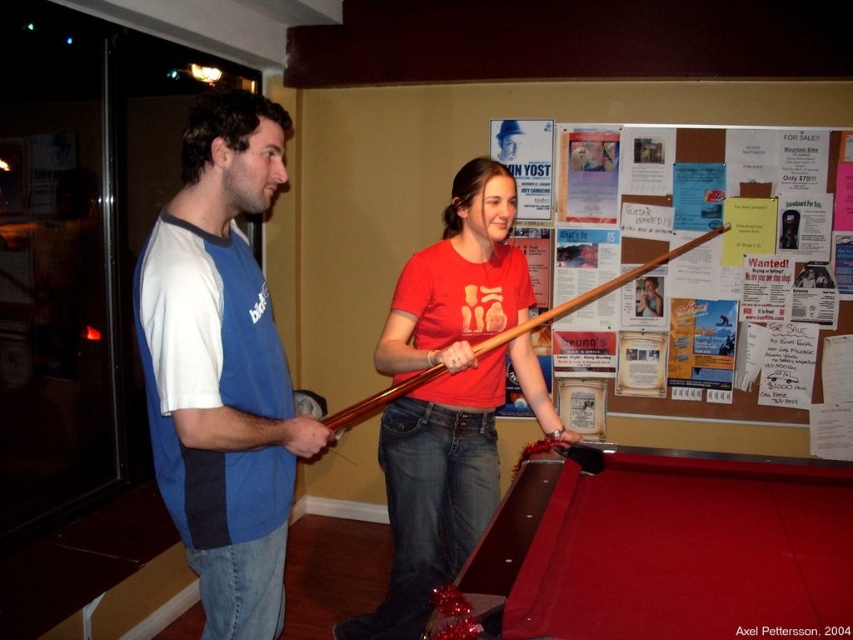
How distant is blue fabric shirt at left from wooden cue at center?

A distance of 21.60 inches exists between blue fabric shirt at left and wooden cue at center.

Who is more forward, [192,296] or [653,260]?

Point [192,296] is in front.

The image size is (853, 640). Identify the location of blue fabric shirt at left. (222, 368).

At what (x,y) coordinates should I click in order to perform the action: click on blue fabric shirt at left. Please return your answer as a coordinate pair (x, y). This screenshot has width=853, height=640. Looking at the image, I should click on (222, 368).

Is matte wood pool cue at center below wooden cue at center?

Yes, matte wood pool cue at center is below wooden cue at center.

Is point (387, 413) in front of point (474, 355)?

No.

The height and width of the screenshot is (640, 853). Describe the element at coordinates (450, 396) in the screenshot. I see `matte wood pool cue at center` at that location.

At what (x,y) coordinates should I click in order to perform the action: click on matte wood pool cue at center. Please return your answer as a coordinate pair (x, y). Looking at the image, I should click on (450, 396).

Who is more distant from viewer, [619,445] or [157,360]?

Positioned behind is point [619,445].

Is red felt pool table at lower center above blue fabric shirt at left?

No, red felt pool table at lower center is not above blue fabric shirt at left.

Identify the location of red felt pool table at lower center. Image resolution: width=853 pixels, height=640 pixels. (666, 548).